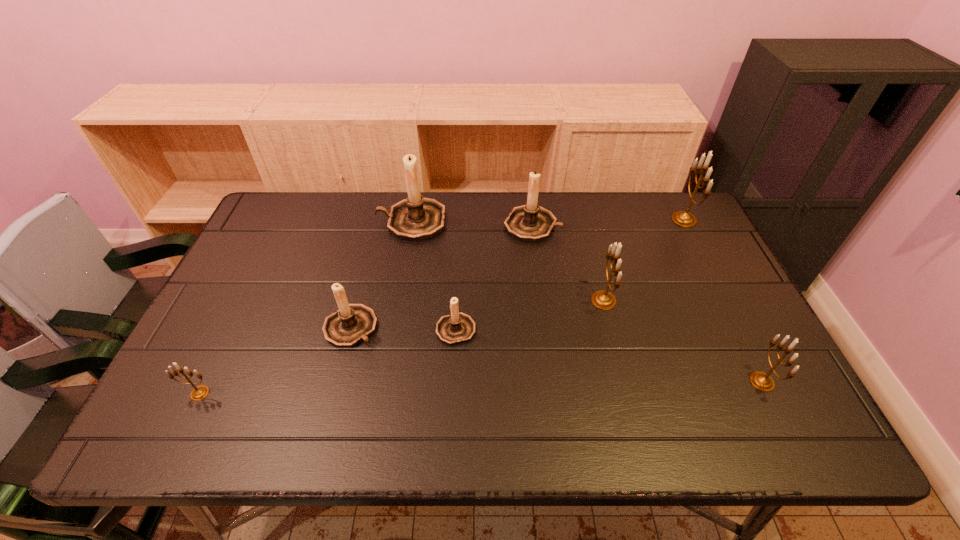
At what (x,y) coordinates should I click in order to perform the action: click on the biggest brown candle holder. Please return your answer as a coordinate pair (x, y). Image resolution: width=960 pixels, height=540 pixels. Looking at the image, I should click on 415,218.

You are a GUI agent. You are given a task and a screenshot of the screen. Output one action in this format:
    pyautogui.click(x=<x>, y=<y>)
    Task: Click on the farthest gold candelabrum
    The height and width of the screenshot is (540, 960).
    Given the screenshot: What is the action you would take?
    pyautogui.click(x=681, y=218)

The height and width of the screenshot is (540, 960). In order to click on the rightmost brown candle holder in this screenshot , I will do `click(530, 222)`.

Locate an element on the screen. The height and width of the screenshot is (540, 960). the fifth object from left to right is located at coordinates (530, 222).

Where is `the second biggest gold candelabrum`? the second biggest gold candelabrum is located at coordinates (604, 300).

Find the location of a particular element. This screenshot has height=540, width=960. the third candelabrum from right to left is located at coordinates (604, 300).

At what (x,y) coordinates should I click in order to perform the action: click on the third biggest brown candle holder. Please return your answer as a coordinate pair (x, y). Looking at the image, I should click on pyautogui.click(x=352, y=323).

Locate an element on the screen. This screenshot has width=960, height=540. the third biggest gold candelabrum is located at coordinates (762, 381).

You are a GUI agent. You are given a task and a screenshot of the screen. Output one action in this format:
    pyautogui.click(x=<x>, y=<y>)
    Task: Click on the smallest brown candle holder
    The height and width of the screenshot is (540, 960).
    Given the screenshot: What is the action you would take?
    pyautogui.click(x=456, y=328)

In order to click on the fifth object from right to left in this screenshot , I will do coord(456,328).